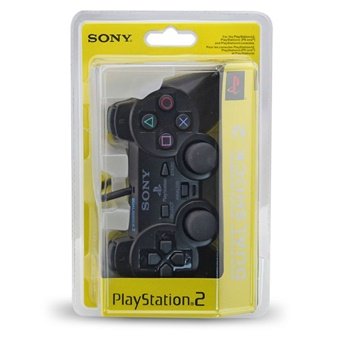
This screenshot has width=340, height=340. Find the location of `sony playstation 2 remote control in black`. sony playstation 2 remote control in black is located at coordinates (152, 195).